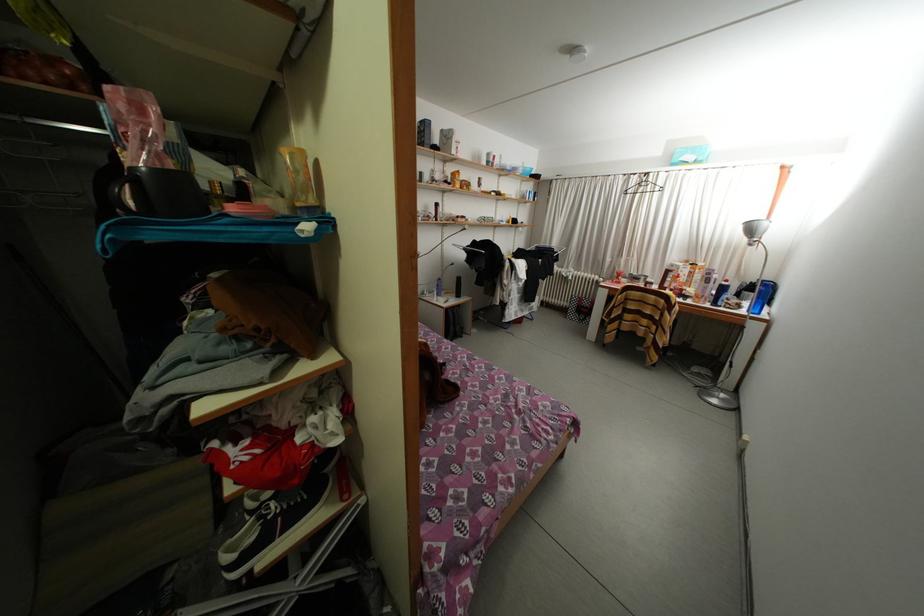
Locate an element on the screen. This screenshot has width=924, height=616. black and white shoe is located at coordinates (271, 527).